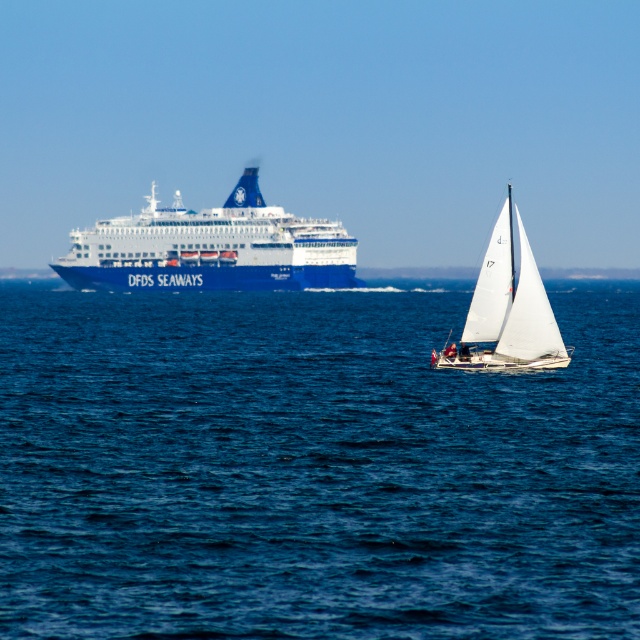
You are a photographer planning to capture the white sailboat at center and the blue matte water at upper center in a single shot. Based on their sizes in the image, which one will occupy more of the frame?

The blue matte water at upper center occupies more space than the white sailboat at center in the image.

You are standing on the deck of the DFDS SEAWAYS cruise ship and want to estimate how far the blue water at center is from you. Based on the scene, can you determine the distance?

The blue water at center is 82.99 feet away from the viewer.

You are a sailor on the small sailboat with white sails marked 17. You need to navigate through the blue water at center and the blue matte water at upper center. Which area should you choose for a smoother passage?

The blue matte water at upper center is smoother because it has a smaller size compared to the blue water at center, which is larger and might have stronger currents or waves.